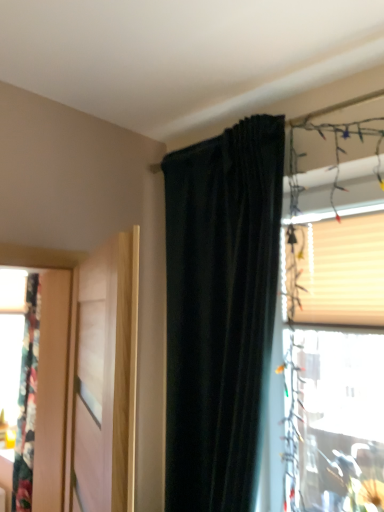
Question: Looking at their shapes, would you say translucent plastic window at upper right is wider or thinner than beige textured blind at upper right?

Choices:
 (A) wide
 (B) thin

Answer: (B)

Question: Is translucent plastic window at upper right inside or outside of beige textured blind at upper right?

Choices:
 (A) outside
 (B) inside

Answer: (A)

Question: Which object is positioned farthest from the translucent plastic window at upper right?

Choices:
 (A) beige textured blind at upper right
 (B) dark velvet curtain at upper center
 (C) light wood door at left

Answer: (C)

Question: Estimate the real-world distances between objects in this image. Which object is farther from the light wood door at left?

Choices:
 (A) dark velvet curtain at upper center
 (B) beige textured blind at upper right
 (C) translucent plastic window at upper right

Answer: (B)